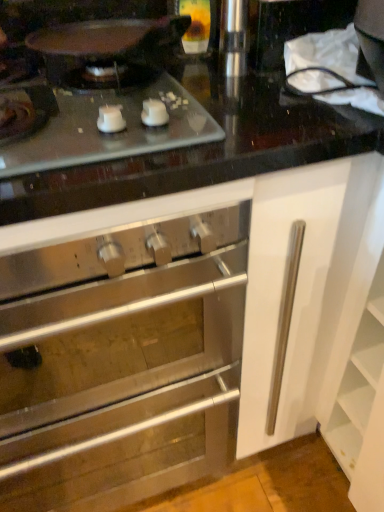
Identify the location of matte glass cooktop at upper left. The height and width of the screenshot is (512, 384). (109, 134).

What do you see at coordinates (109, 134) in the screenshot?
I see `matte glass cooktop at upper left` at bounding box center [109, 134].

What do you see at coordinates (190, 335) in the screenshot?
I see `stainless steel oven at center` at bounding box center [190, 335].

Find the location of a particular element. stainless steel oven at center is located at coordinates (190, 335).

The height and width of the screenshot is (512, 384). In order to click on matte glass cooktop at upper left in this screenshot , I will do `click(109, 134)`.

Visually, is stainless steel oven at center positioned to the left or to the right of matte glass cooktop at upper left?

In the image, stainless steel oven at center appears on the left side of matte glass cooktop at upper left.

Is stainless steel oven at center behind matte glass cooktop at upper left?

No, stainless steel oven at center is closer to the viewer.

Considering the points (52, 500) and (130, 123), which point is behind, point (52, 500) or point (130, 123)?

The point (52, 500) is more distant.

From the image's perspective, is stainless steel oven at center on matte glass cooktop at upper left?

Actually, stainless steel oven at center appears below matte glass cooktop at upper left in the image.

From a real-world perspective, which object rests below the other?

stainless steel oven at center.

Considering the sizes of stainless steel oven at center and matte glass cooktop at upper left in the image, is stainless steel oven at center wider or thinner than matte glass cooktop at upper left?

Clearly, stainless steel oven at center has more width compared to matte glass cooktop at upper left.

Is stainless steel oven at center shorter than matte glass cooktop at upper left?

In fact, stainless steel oven at center may be taller than matte glass cooktop at upper left.

Can you confirm if stainless steel oven at center is bigger than matte glass cooktop at upper left?

Yes.

Is stainless steel oven at center positioned beyond the bounds of matte glass cooktop at upper left?

Absolutely, stainless steel oven at center is external to matte glass cooktop at upper left.

Are stainless steel oven at center and matte glass cooktop at upper left making contact?

stainless steel oven at center and matte glass cooktop at upper left are clearly separated.

Is stainless steel oven at center oriented towards matte glass cooktop at upper left?

No, stainless steel oven at center is not turned towards matte glass cooktop at upper left.

How many degrees apart are the facing directions of stainless steel oven at center and matte glass cooktop at upper left?

The angular difference between stainless steel oven at center and matte glass cooktop at upper left is 0.000155 degrees.

Measure the distance from stainless steel oven at center to matte glass cooktop at upper left.

stainless steel oven at center is 14.32 inches away from matte glass cooktop at upper left.

Locate an element on the screen. The height and width of the screenshot is (512, 384). gas stove located behind the stainless steel oven at center is located at coordinates (109, 134).

Between matte glass cooktop at upper left and stainless steel oven at center, which one appears on the right side from the viewer's perspective?

Positioned to the right is matte glass cooktop at upper left.

Is the depth of matte glass cooktop at upper left less than that of stainless steel oven at center?

No, matte glass cooktop at upper left is further to the viewer.

Does point (175, 138) lie in front of point (207, 406)?

That is True.

Consider the image. From the image's perspective, is matte glass cooktop at upper left under stainless steel oven at center?

No, from the image's perspective, matte glass cooktop at upper left is not below stainless steel oven at center.

From a real-world perspective, is matte glass cooktop at upper left located beneath stainless steel oven at center?

No, from a real-world perspective, matte glass cooktop at upper left is not below stainless steel oven at center.

Considering the relative sizes of matte glass cooktop at upper left and stainless steel oven at center in the image provided, is matte glass cooktop at upper left wider than stainless steel oven at center?

In fact, matte glass cooktop at upper left might be narrower than stainless steel oven at center.

Considering the sizes of objects matte glass cooktop at upper left and stainless steel oven at center in the image provided, who is taller, matte glass cooktop at upper left or stainless steel oven at center?

stainless steel oven at center.

Which of these two, matte glass cooktop at upper left or stainless steel oven at center, is bigger?

stainless steel oven at center is bigger.

Based on the photo, would you say stainless steel oven at center is part of matte glass cooktop at upper left's contents?

No, stainless steel oven at center is located outside of matte glass cooktop at upper left.

Is matte glass cooktop at upper left far away from stainless steel oven at center?

No, matte glass cooktop at upper left is not far away from stainless steel oven at center.

Is matte glass cooktop at upper left oriented away from stainless steel oven at center?

No.

Can you tell me how much matte glass cooktop at upper left and stainless steel oven at center differ in facing direction?

matte glass cooktop at upper left and stainless steel oven at center are facing 0.000155 degrees away from each other.

Where is `gas stove above the stainless steel oven at center (from the image's perspective)`? gas stove above the stainless steel oven at center (from the image's perspective) is located at coordinates (109, 134).

Locate an element on the screen. This screenshot has width=384, height=512. gas stove above the stainless steel oven at center (from the image's perspective) is located at coordinates (109, 134).

The image size is (384, 512). I want to click on cabinetry in front of the matte glass cooktop at upper left, so click(190, 335).